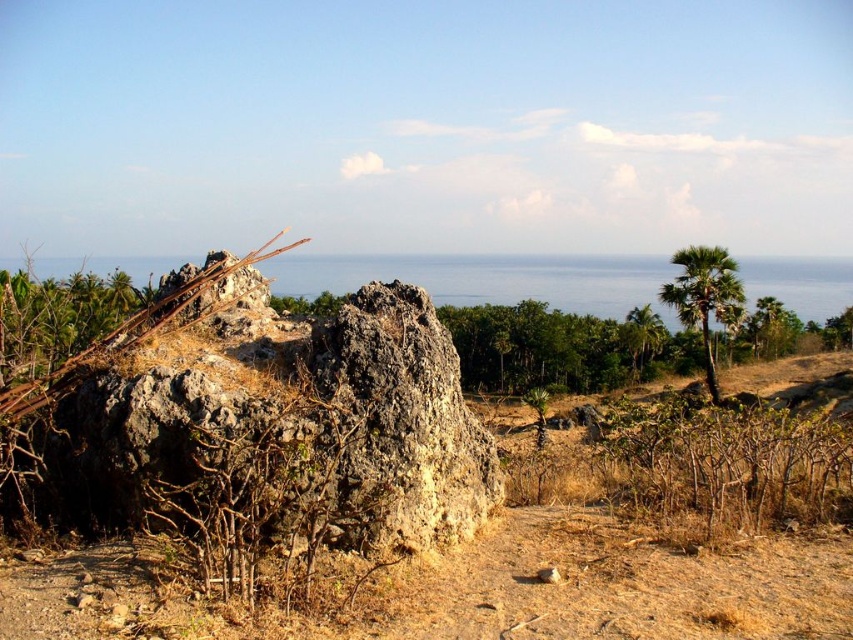
Question: Observing the image, what is the correct spatial positioning of gray rough rock at center in reference to green leafy palm tree at upper right?

Choices:
 (A) below
 (B) above

Answer: (B)

Question: Which is nearer to the green leafy palm tree at upper right?

Choices:
 (A) gray rough rock at center
 (B) green leafy trees at center

Answer: (B)

Question: Which point is farther to the camera?

Choices:
 (A) (683, 253)
 (B) (573, 346)

Answer: (B)

Question: Is gray rough rock at center above green leafy trees at center?

Choices:
 (A) no
 (B) yes

Answer: (B)

Question: Does green leafy trees at center have a greater width compared to green leafy palm tree at upper right?

Choices:
 (A) yes
 (B) no

Answer: (A)

Question: Among these objects, which one is farthest from the camera?

Choices:
 (A) green leafy palm tree at upper right
 (B) green leafy trees at center

Answer: (A)